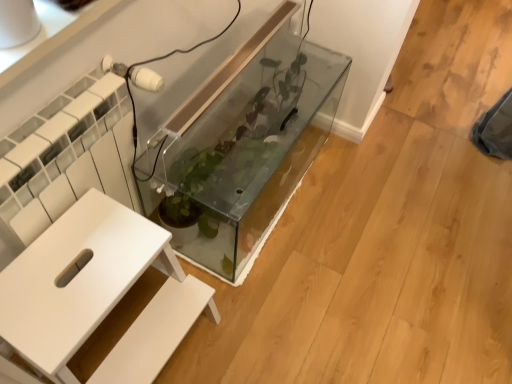
Question: Considering their positions, is white textured radiator at left located in front of or behind white matte table at center?

Choices:
 (A) front
 (B) behind

Answer: (B)

Question: Is white textured radiator at left wider or thinner than white matte table at center?

Choices:
 (A) wide
 (B) thin

Answer: (B)

Question: Considering the real-world distances, which object is closest to the transparent glass tank at center?

Choices:
 (A) white textured radiator at left
 (B) white matte table at center

Answer: (A)

Question: Based on their relative distances, which object is farther from the white matte table at center?

Choices:
 (A) white textured radiator at left
 (B) transparent glass tank at center

Answer: (B)